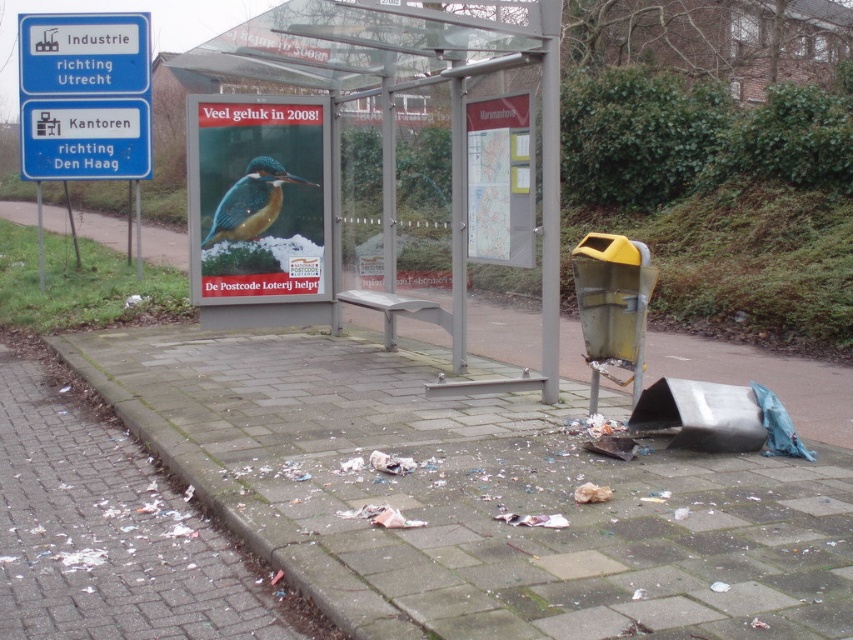
Question: Is the position of concrete pavement at lower center less distant than that of white brick pavement at lower left?

Choices:
 (A) no
 (B) yes

Answer: (A)

Question: Which of the following is the farthest from the observer?

Choices:
 (A) (32, 122)
 (B) (206, 561)
 (C) (221, 378)
 (D) (247, 198)

Answer: (A)

Question: Can you confirm if blue plastic sign at upper left is smaller than blue plastic sign at left?

Choices:
 (A) yes
 (B) no

Answer: (A)

Question: Which point appears closest to the camera in this image?

Choices:
 (A) click(x=4, y=515)
 (B) click(x=579, y=566)
 (C) click(x=56, y=132)

Answer: (B)

Question: Can you confirm if blue plastic sign at left is positioned below shiny blue-green bird at center?

Choices:
 (A) no
 (B) yes

Answer: (A)

Question: Which point is closer to the camera?

Choices:
 (A) blue plastic sign at upper left
 (B) blue plastic sign at left
 (C) shiny blue-green bird at center

Answer: (C)